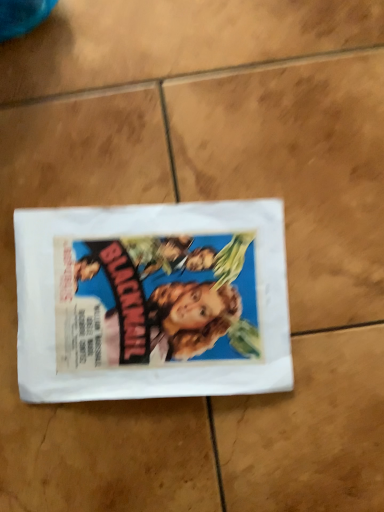
Where is `white paper album at center`? This screenshot has height=512, width=384. white paper album at center is located at coordinates (152, 302).

The width and height of the screenshot is (384, 512). What do you see at coordinates (152, 302) in the screenshot? I see `white paper album at center` at bounding box center [152, 302].

What is the approximate height of white paper album at center?

It is 2.69 centimeters.

Locate an element on the screen. white paper album at center is located at coordinates (152, 302).